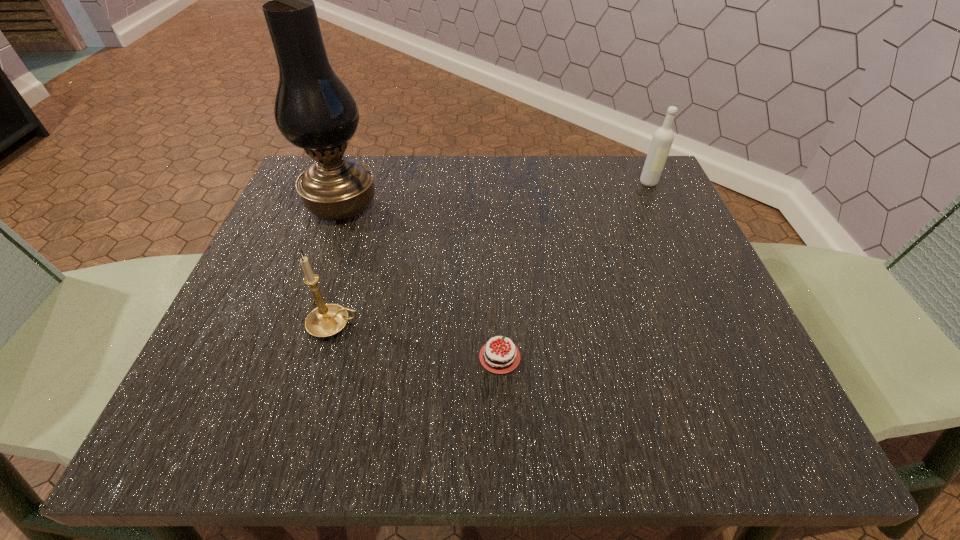
Locate an element on the screen. vodka at the far edge is located at coordinates (662, 140).

Identify the location of object that is at the near edge. (497, 359).

The image size is (960, 540). I want to click on oil lamp present at the left edge, so click(314, 110).

Identify the location of candle holder at the left edge. (326, 320).

Locate an element on the screen. This screenshot has height=540, width=960. object at the right edge is located at coordinates (662, 140).

Image resolution: width=960 pixels, height=540 pixels. In order to click on object at the far left corner in this screenshot , I will do `click(314, 110)`.

Image resolution: width=960 pixels, height=540 pixels. In order to click on object positioned at the far right corner in this screenshot , I will do `click(662, 140)`.

Image resolution: width=960 pixels, height=540 pixels. Identify the location of vacant area at the far edge. (516, 168).

In order to click on vacant space at the near edge of the desktop in this screenshot , I will do `click(538, 411)`.

At what (x,y) coordinates should I click in order to perform the action: click on free space at the left edge of the desktop. Please return your answer as a coordinate pair (x, y). This screenshot has height=540, width=960. Looking at the image, I should click on (327, 227).